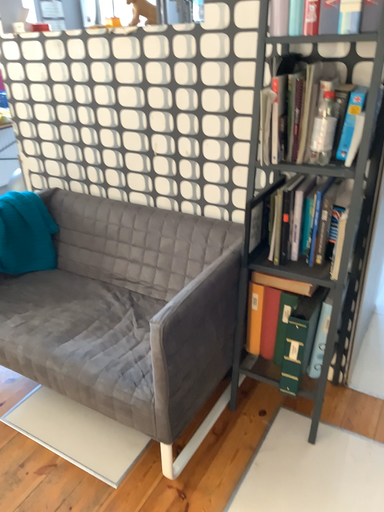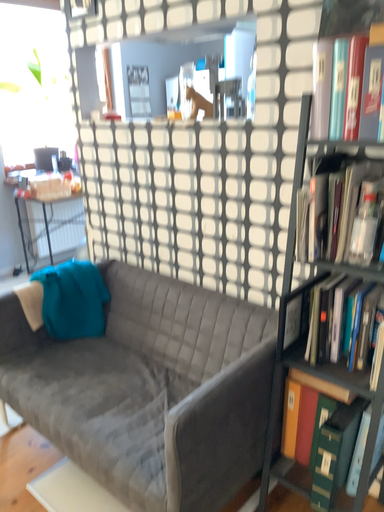
Question: How did the camera likely rotate when shooting the video?

Choices:
 (A) rotated upward
 (B) rotated downward

Answer: (A)